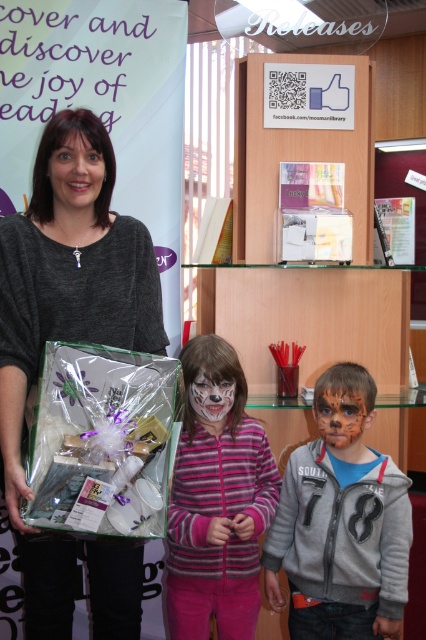
You are a photographer taking a picture of the scene. You notice the pink striped sweater at center and the white matte face paint at center. Which object should you focus on first if you want to capture both in the same frame without moving the camera?

You should focus on the pink striped sweater at center first because it is below the white matte face paint at center, so adjusting focus to the lower area will ensure both are in the frame.

You are a photographer taking a picture of the two children in the scene. You want to ensure that both the pink striped sweater at center and the white matte face paint at center are clearly visible. Based on their positions, which one should you focus on first to ensure proper framing?

The white matte face paint at center should be focused on first since the pink striped sweater at center is positioned to its right. By focusing on the leftmost element first, you can ensure both are included in the frame.

You are organizing a childrens event and need to place a 1.2 meter wide banner between the pink striped sweater at center and the matte black face at upper left. Can the banner fit between them?

The pink striped sweater at center is wider than the matte black face at upper left, so the 1.2 meter wide banner may not fit between them unless there is sufficient space. However, without specific distance information between the two objects, it is impossible to determine exact fit.